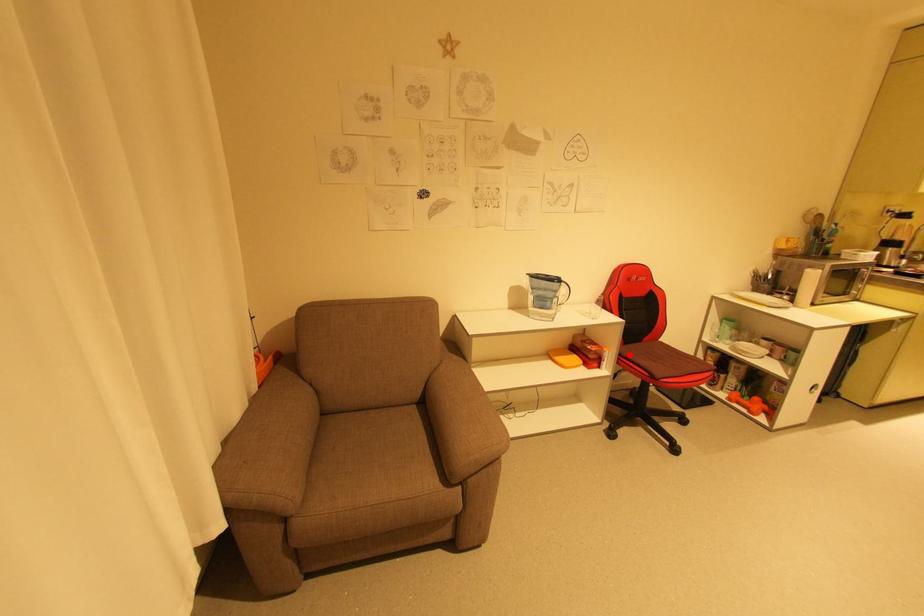
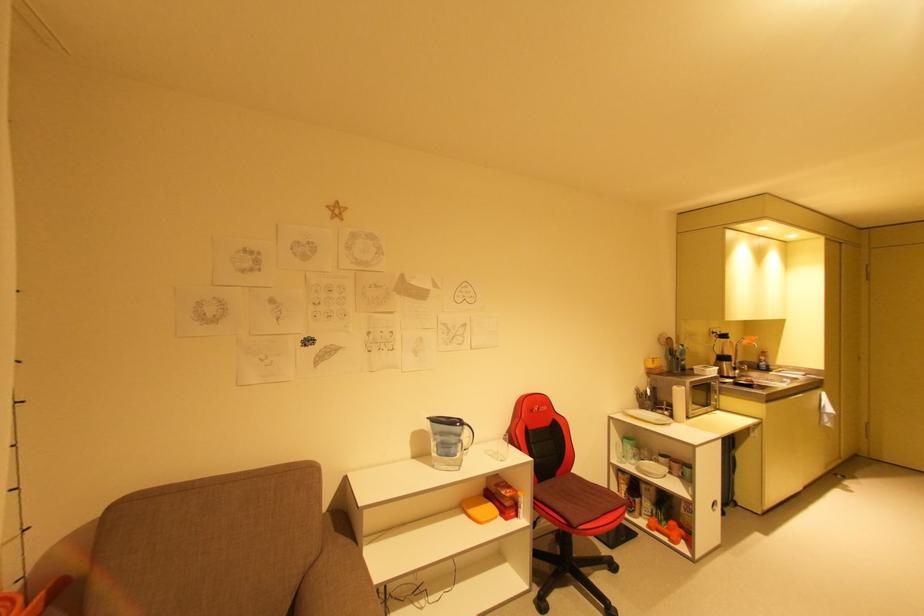
The point at the highlighted location is marked in the first image. Where is the corresponding point in the second image?

(544, 498)